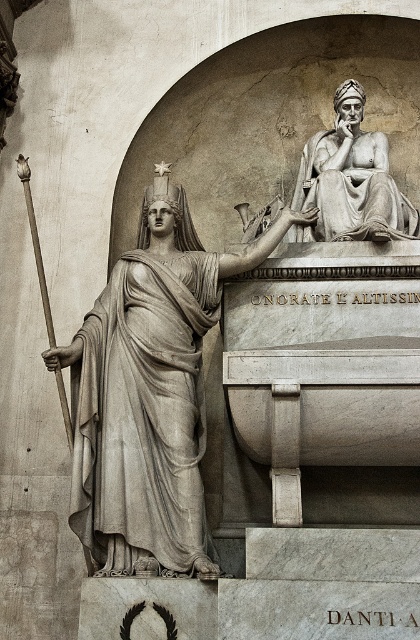
You are an art curator assessing the placement of statues in a gallery. You have the gray stone statue at left and the matte gray statue at upper right in front of you. Based on their sizes, which statue would require a larger base to remain stable?

The gray stone statue at left is taller than the matte gray statue at upper right, so it would require a larger base to remain stable.